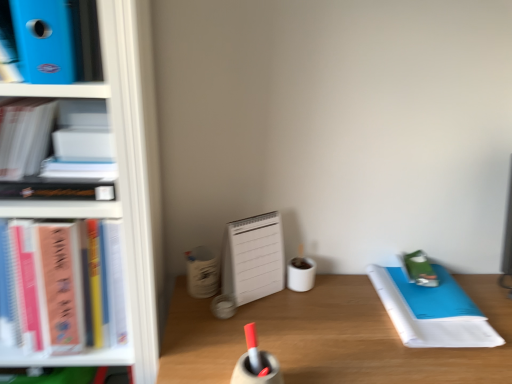
At what (x,y) coordinates should I click in order to perform the action: click on free space above wooden desk at center (from a real-world perspective). Please return your answer as a coordinate pair (x, y). The width and height of the screenshot is (512, 384). Looking at the image, I should click on point(364,325).